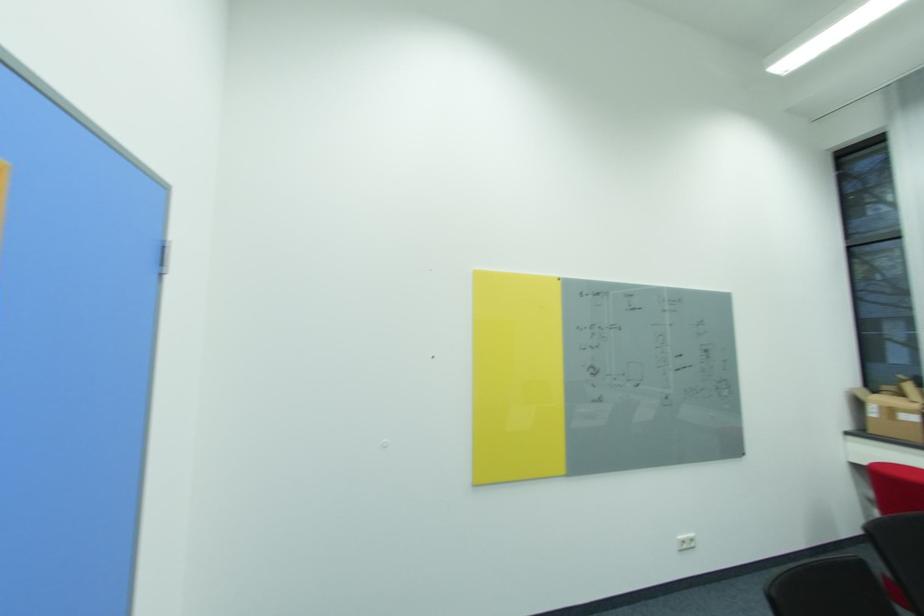
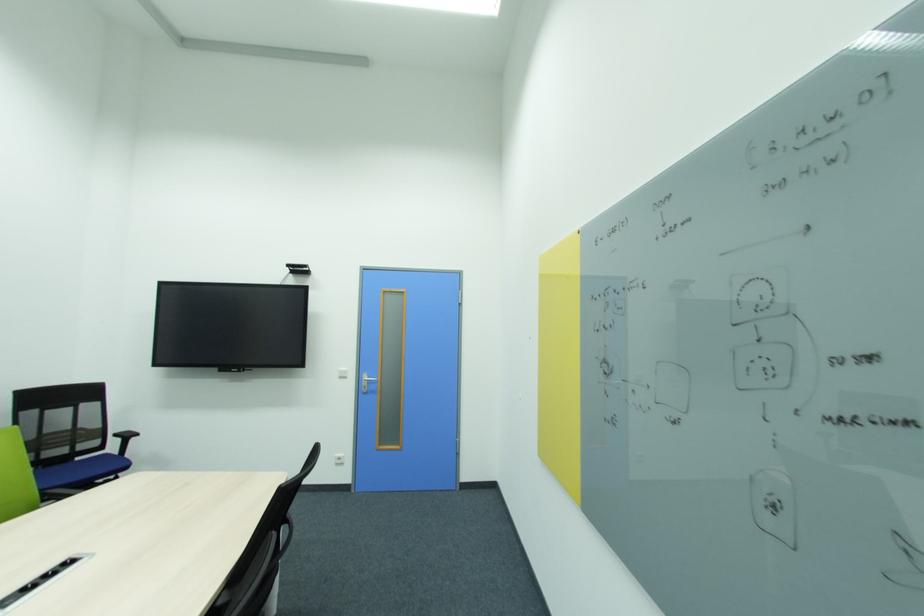
The point at (596, 369) is marked in the first image. Where is the corresponding point in the second image?

(610, 362)